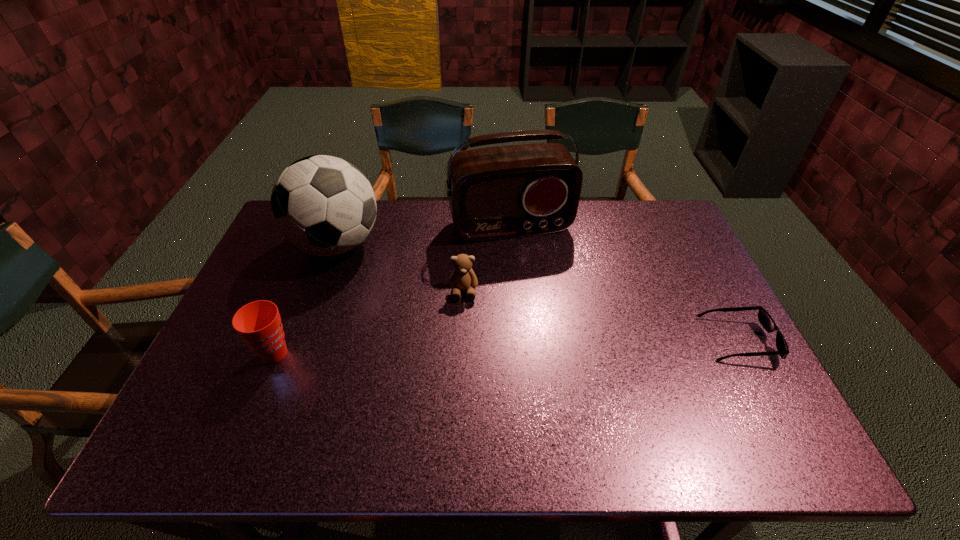
Where is `vacant space situated 0.180m on the main logo of the soccer ball`? The width and height of the screenshot is (960, 540). vacant space situated 0.180m on the main logo of the soccer ball is located at coordinates click(397, 300).

Where is `vacant space located on the front panel of the radio receiver`? The width and height of the screenshot is (960, 540). vacant space located on the front panel of the radio receiver is located at coordinates (553, 321).

This screenshot has height=540, width=960. I want to click on free space located 0.070m on the front panel of the radio receiver, so (529, 259).

Find the location of `vacant point located on the front panel of the radio receiver`. vacant point located on the front panel of the radio receiver is located at coordinates (556, 329).

The width and height of the screenshot is (960, 540). Find the location of `vacant space located on the face of the third farthest object`. vacant space located on the face of the third farthest object is located at coordinates (465, 325).

This screenshot has height=540, width=960. What are the coordinates of `free space located 0.230m on the face of the third farthest object` in the screenshot? It's located at (465, 373).

The width and height of the screenshot is (960, 540). Find the location of `vacant space located 0.260m on the face of the third farthest object`. vacant space located 0.260m on the face of the third farthest object is located at coordinates (466, 383).

Identify the location of soccer ball located in the far edge section of the desktop. (322, 205).

The image size is (960, 540). Identify the location of radio receiver situated at the far edge. (501, 192).

Locate an element on the screen. This screenshot has width=960, height=540. cup positioned at the left edge is located at coordinates (259, 323).